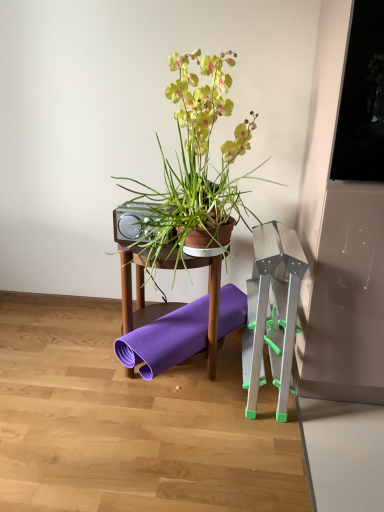
Measure the distance between matte brown pot at center and camera.

The distance of matte brown pot at center from camera is 1.35 meters.

The height and width of the screenshot is (512, 384). What do you see at coordinates (137, 293) in the screenshot? I see `wooden table at center` at bounding box center [137, 293].

At what (x,y) coordinates should I click in order to perform the action: click on wooden table at center. Please return your answer as a coordinate pair (x, y). The height and width of the screenshot is (512, 384). Looking at the image, I should click on (137, 293).

Measure the distance between point (150,205) and camera.

The distance of point (150,205) from camera is 1.48 meters.

Image resolution: width=384 pixels, height=512 pixels. What do you see at coordinates (362, 99) in the screenshot?
I see `transparent glass window screen at upper right` at bounding box center [362, 99].

Identify the location of matte brown pot at center. Image resolution: width=384 pixels, height=512 pixels. (196, 161).

Where is `table behind the transparent glass window screen at upper right`? The width and height of the screenshot is (384, 512). table behind the transparent glass window screen at upper right is located at coordinates (137, 293).

Is transparent glass window screen at upper right in front of or behind wooden table at center in the image?

transparent glass window screen at upper right is in front of wooden table at center.

Which object is positioned more to the left, transparent glass window screen at upper right or wooden table at center?

wooden table at center is more to the left.

Considering the sizes of objects transparent glass window screen at upper right and wooden table at center in the image provided, who is shorter, transparent glass window screen at upper right or wooden table at center?

Standing shorter between the two is wooden table at center.

Is metallic silver speaker at center far away from wooden table at center?

That's not correct — metallic silver speaker at center is a little close to wooden table at center.

Between point (143, 234) and point (126, 308), which one is positioned behind?

The point (126, 308) is more distant.

Which of these two, metallic silver speaker at center or wooden table at center, stands shorter?

metallic silver speaker at center is shorter.

Is metallic silver speaker at center turned away from wooden table at center?

No, metallic silver speaker at center is not facing the opposite direction of wooden table at center.

Measure the distance from metallic silver speaker at center to matte brown pot at center.

The distance of metallic silver speaker at center from matte brown pot at center is 9.21 inches.

From a real-world perspective, does metallic silver speaker at center stand above matte brown pot at center?

No, from a real-world perspective, metallic silver speaker at center is not above matte brown pot at center.

Is metallic silver speaker at center shorter than matte brown pot at center?

Yes, metallic silver speaker at center is shorter than matte brown pot at center.

Considering the positions of objects metallic silver speaker at center and matte brown pot at center in the image provided, who is behind, metallic silver speaker at center or matte brown pot at center?

metallic silver speaker at center is more distant.

Considering their positions, is transparent glass window screen at upper right located in front of or behind matte brown pot at center?

Visually, transparent glass window screen at upper right is located in front of matte brown pot at center.

Where is `houseplant on the left side of transparent glass window screen at upper right`? The image size is (384, 512). houseplant on the left side of transparent glass window screen at upper right is located at coordinates (196, 161).

Does transparent glass window screen at upper right have a greater height compared to matte brown pot at center?

In fact, transparent glass window screen at upper right may be shorter than matte brown pot at center.

Looking at this image, from the image's perspective, which one is positioned lower, transparent glass window screen at upper right or matte brown pot at center?

matte brown pot at center.

You are a GUI agent. You are given a task and a screenshot of the screen. Output one action in this format:
    pyautogui.click(x=<x>, y=<y>)
    Task: Click on the window screen that is above the metallic silver speaker at center (from the image's perspective)
    This screenshot has width=384, height=512.
    Given the screenshot: What is the action you would take?
    pyautogui.click(x=362, y=99)

Looking at the image, does transparent glass window screen at upper right seem bigger or smaller compared to metallic silver speaker at center?

In the image, transparent glass window screen at upper right appears to be larger than metallic silver speaker at center.

Is transparent glass window screen at upper right not close to metallic silver speaker at center?

No, transparent glass window screen at upper right is in close proximity to metallic silver speaker at center.

How different are the orientations of transparent glass window screen at upper right and metallic silver speaker at center in degrees?

5.44 degrees.

Which is more to the left, matte brown pot at center or transparent glass window screen at upper right?

From the viewer's perspective, matte brown pot at center appears more on the left side.

Consider the image. From a real-world perspective, which object rests below the other?

matte brown pot at center, from a real-world perspective.

Is matte brown pot at center aimed at transparent glass window screen at upper right?

No.

Are matte brown pot at center and transparent glass window screen at upper right beside each other?

No, matte brown pot at center is not touching transparent glass window screen at upper right.

Which object is further away from the camera taking this photo, matte brown pot at center or metallic silver speaker at center?

metallic silver speaker at center is further away from the camera.

The width and height of the screenshot is (384, 512). I want to click on houseplant above the metallic silver speaker at center (from the image's perspective), so click(196, 161).

Is matte brown pot at center taller or shorter than metallic silver speaker at center?

Clearly, matte brown pot at center is taller compared to metallic silver speaker at center.

Considering the sizes of objects matte brown pot at center and metallic silver speaker at center in the image provided, who is thinner, matte brown pot at center or metallic silver speaker at center?

metallic silver speaker at center.

The image size is (384, 512). In order to click on table on the left of transparent glass window screen at upper right in this screenshot , I will do `click(137, 293)`.

This screenshot has width=384, height=512. I want to click on table in front of the metallic silver speaker at center, so click(137, 293).

When comparing their distances from metallic silver speaker at center, does wooden table at center or matte brown pot at center seem closer?

wooden table at center is closer to metallic silver speaker at center.

Estimate the real-world distances between objects in this image. Which object is closer to wooden table at center, silver metallic step stool at right or matte brown pot at center?

silver metallic step stool at right.

Based on the photo, based on their spatial positions, is silver metallic step stool at right or matte brown pot at center further from metallic silver speaker at center?

silver metallic step stool at right.

Which object lies nearer to the anchor point wooden table at center, matte brown pot at center or metallic silver speaker at center?

The object closer to wooden table at center is metallic silver speaker at center.

Based on their spatial positions, is wooden table at center or metallic silver speaker at center further from matte brown pot at center?

wooden table at center is further to matte brown pot at center.

When comparing their distances from wooden table at center, does matte brown pot at center or transparent glass window screen at upper right seem closer?

matte brown pot at center is closer to wooden table at center.

When comparing their distances from wooden table at center, does transparent glass window screen at upper right or matte brown pot at center seem closer?

matte brown pot at center is positioned closer to the anchor wooden table at center.

Which object lies nearer to the anchor point transparent glass window screen at upper right, wooden table at center or matte brown pot at center?

The object closer to transparent glass window screen at upper right is matte brown pot at center.

This screenshot has height=512, width=384. Identify the location of table between metallic silver speaker at center and silver metallic step stool at right from left to right. (137, 293).

Find the location of `step stool located between metallic silver speaker at center and transparent glass window screen at upper right in the left-right direction`. step stool located between metallic silver speaker at center and transparent glass window screen at upper right in the left-right direction is located at coordinates (272, 312).

Find the location of `houseplant between transparent glass window screen at upper right and silver metallic step stool at right in the up-down direction`. houseplant between transparent glass window screen at upper right and silver metallic step stool at right in the up-down direction is located at coordinates (196, 161).

At what (x,y) coordinates should I click in order to perform the action: click on table between metallic silver speaker at center and transparent glass window screen at upper right. Please return your answer as a coordinate pair (x, y). The image size is (384, 512). Looking at the image, I should click on (137, 293).